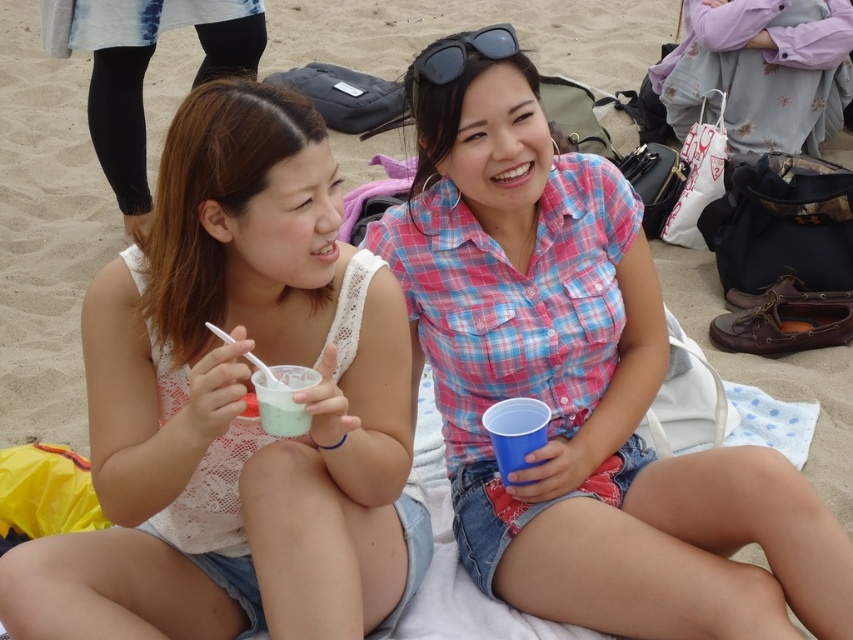
Does matte white tank top at center have a lesser height compared to white matte cup at center?

No.

Between point (143, 116) and point (276, 365), which one is positioned behind?

Positioned behind is point (143, 116).

What do you see at coordinates (143, 70) in the screenshot? I see `matte white tank top at center` at bounding box center [143, 70].

Image resolution: width=853 pixels, height=640 pixels. What are the coordinates of `matte white tank top at center` in the screenshot? It's located at (143, 70).

Find the location of a particular element. The height and width of the screenshot is (640, 853). white lace tank top at center is located at coordinates (236, 406).

Is white lace tank top at center thinner than matte white tank top at center?

Yes, white lace tank top at center is thinner than matte white tank top at center.

Who is more distant from viewer, (x=351, y=516) or (x=134, y=97)?

The point (x=134, y=97) is more distant.

At what (x,y) coordinates should I click in order to perform the action: click on white lace tank top at center. Please return your answer as a coordinate pair (x, y). The image size is (853, 640). Looking at the image, I should click on (236, 406).

Which is above, pink plaid shirt at center or white matte cup at center?

pink plaid shirt at center is higher up.

How far apart are pink plaid shirt at center and white matte cup at center?

pink plaid shirt at center and white matte cup at center are 29.09 inches apart.

Who is more forward, (616, 588) or (294, 388)?

Point (294, 388) is more forward.

Find the location of a particular element. This screenshot has height=640, width=853. pink plaid shirt at center is located at coordinates (582, 392).